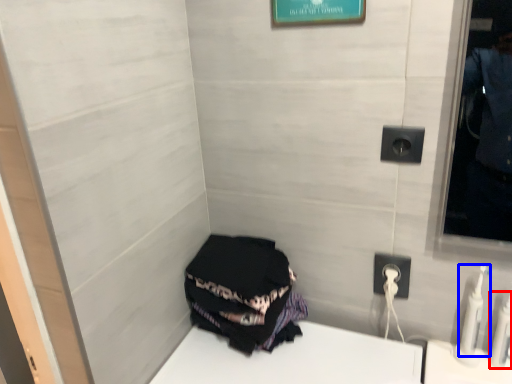
Question: Which point is further to the camera, toiletry (highlighted by a red box) or toiletry (highlighted by a blue box)?

Choices:
 (A) toiletry
 (B) toiletry

Answer: (B)